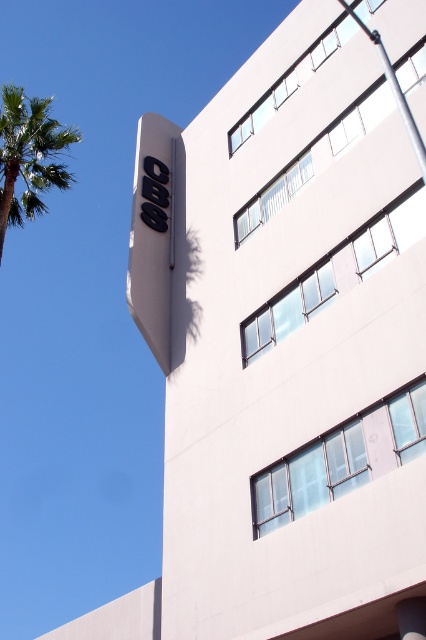
Question: Among these points, which one is farthest from the camera?

Choices:
 (A) (391, 74)
 (B) (5, 163)

Answer: (B)

Question: Does black matte sign at upper left have a greater width compared to silver metallic pole at upper right?

Choices:
 (A) yes
 (B) no

Answer: (A)

Question: Which is nearer to the silver metallic pole at upper right?

Choices:
 (A) black matte sign at upper left
 (B) green leafy palm tree at left

Answer: (A)

Question: Can you confirm if black matte sign at upper left is positioned below silver metallic pole at upper right?

Choices:
 (A) no
 (B) yes

Answer: (B)

Question: Which object appears farthest from the camera in this image?

Choices:
 (A) green leafy palm tree at left
 (B) black matte sign at upper left

Answer: (B)

Question: Can you confirm if green leafy palm tree at left is positioned above silver metallic pole at upper right?

Choices:
 (A) yes
 (B) no

Answer: (A)